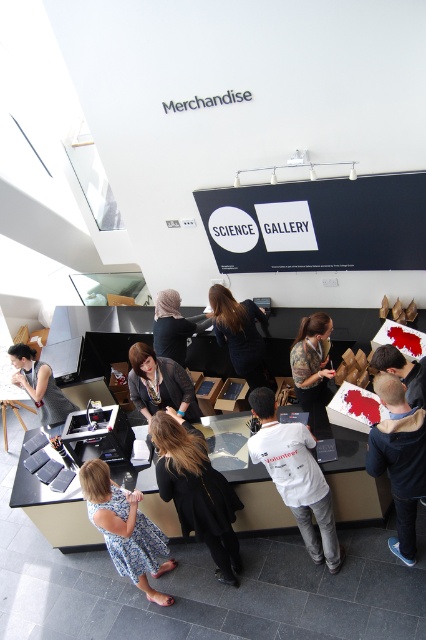
You are a customer in the Science Gallery store and want to pick up both the black matte jacket at center and the blue fleece jacket at lower right. Which jacket will you need to reach for first, considering their positions relative to you?

You will need to reach for the black matte jacket at center first because it is closer to you than the blue fleece jacket at lower right, which is further away.

You are a customer in the Science Gallery store and want to buy a jacket. You see the black matte jacket at center and the blue fleece jacket at lower right. Which jacket is taller?

The blue fleece jacket at lower right is taller than the black matte jacket at center.